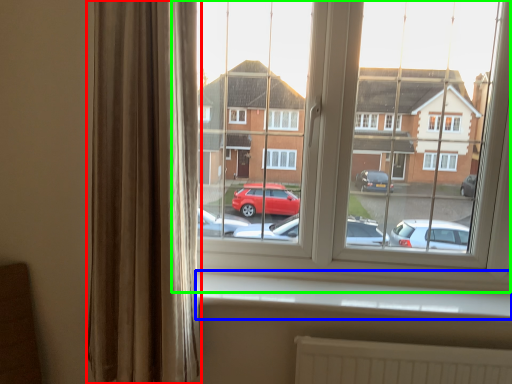
Question: Estimate the real-world distances between objects in this image. Which object is closer to curtain (highlighted by a red box), window sill (highlighted by a blue box) or window (highlighted by a green box)?

Choices:
 (A) window sill
 (B) window

Answer: (A)